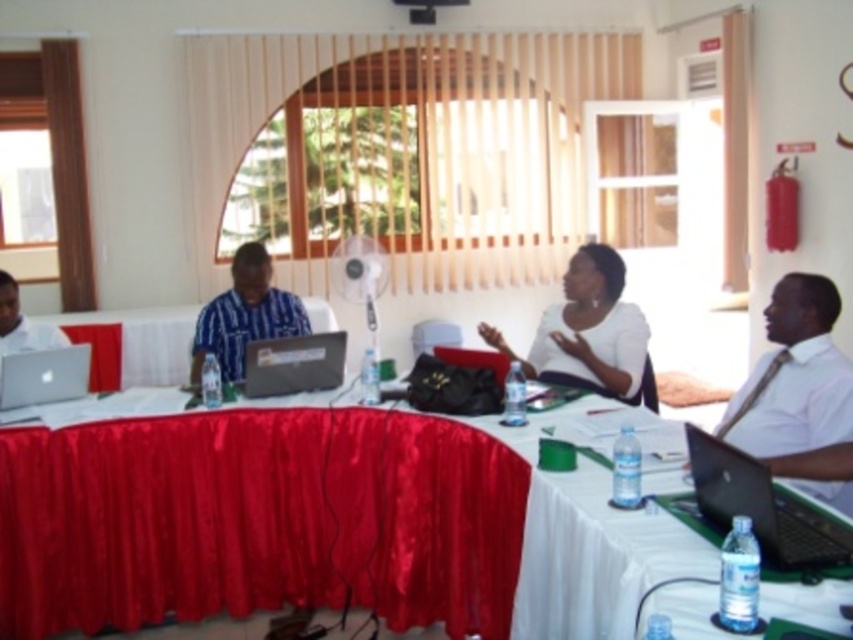
Question: Which of the following is the closest to the observer?

Choices:
 (A) (262, 372)
 (B) (793, 280)
 (C) (587, 339)
 (D) (9, 353)

Answer: (B)

Question: Does white shirt at right appear over black glossy laptop at lower right?

Choices:
 (A) no
 (B) yes

Answer: (B)

Question: Is black glossy laptop at lower right positioned before blue striped shirt at center?

Choices:
 (A) no
 (B) yes

Answer: (B)

Question: Which point is farther to the camera?

Choices:
 (A) blue striped shirt at center
 (B) red satin tablecloth at center
 (C) black glossy laptop at lower right

Answer: (A)

Question: From the image, what is the correct spatial relationship of white matte shirt at center in relation to silver metallic laptop at lower left?

Choices:
 (A) below
 (B) above

Answer: (B)

Question: Among these objects, which one is nearest to the camera?

Choices:
 (A) white matte shirt at center
 (B) silver metallic laptop at lower left
 (C) matte silver laptop at left

Answer: (B)